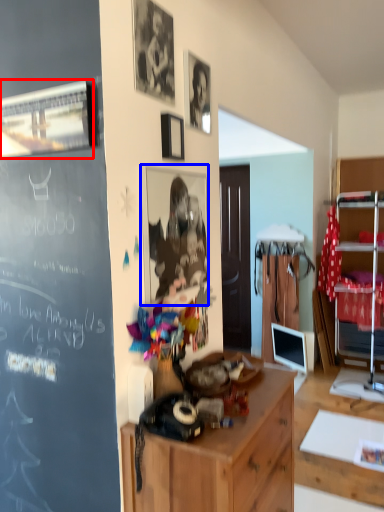
Question: Which of the following is the farthest to the observer, picture frame (highlighted by a red box) or picture frame (highlighted by a blue box)?

Choices:
 (A) picture frame
 (B) picture frame

Answer: (B)